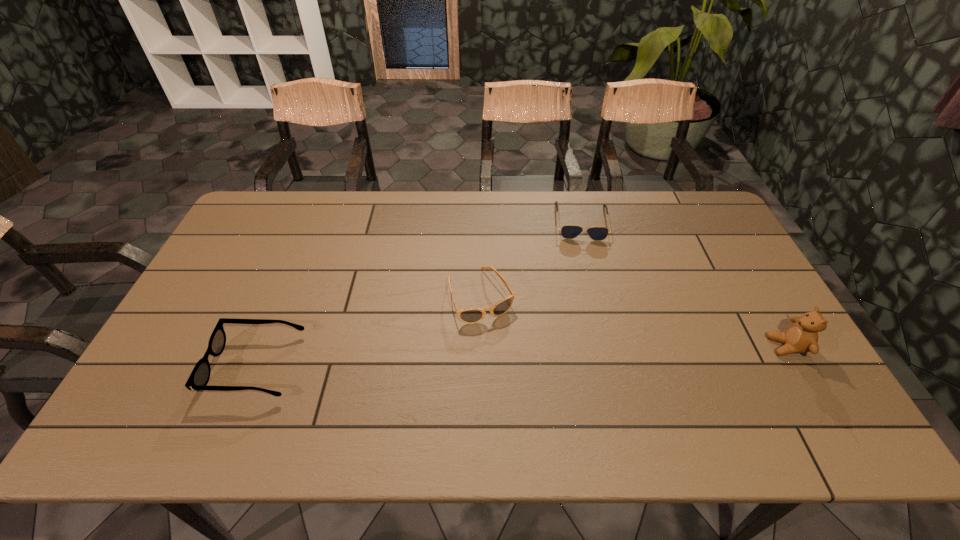
This screenshot has height=540, width=960. I want to click on object that is at the near edge, so click(199, 377).

Find the location of a particular element. The width and height of the screenshot is (960, 540). object present at the left edge is located at coordinates (199, 377).

Locate an element on the screen. The height and width of the screenshot is (540, 960). object present at the right edge is located at coordinates (801, 337).

Locate an element on the screen. This screenshot has height=540, width=960. object located in the near left corner section of the desktop is located at coordinates (199, 377).

In the image, there is a desktop. Where is `free region at the far edge`? The image size is (960, 540). free region at the far edge is located at coordinates coord(601,220).

The width and height of the screenshot is (960, 540). I want to click on blank space at the near edge, so click(358, 390).

This screenshot has width=960, height=540. Find the location of `free space at the left edge of the desktop`. free space at the left edge of the desktop is located at coordinates (196, 338).

Locate an element on the screen. The image size is (960, 540). vacant area at the right edge is located at coordinates (763, 317).

Where is `blank space at the far right corner of the desktop`? blank space at the far right corner of the desktop is located at coordinates (700, 231).

This screenshot has width=960, height=540. In the image, there is a desktop. What are the coordinates of `vacant area at the near right corner` in the screenshot? It's located at (798, 393).